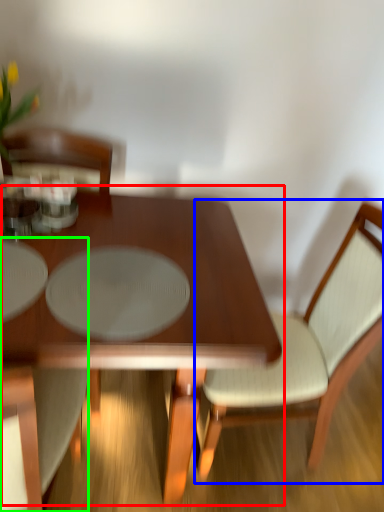
Question: Based on their relative distances, which object is nearer to coffee table (highlighted by a red box)? Choose from chair (highlighted by a blue box) and chair (highlighted by a green box).

Choices:
 (A) chair
 (B) chair

Answer: (B)